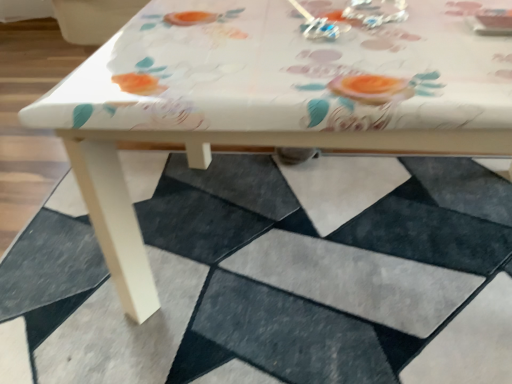
Question: Could you tell me if metallic silver earrings at upper center is facing white matte rug at lower center?

Choices:
 (A) no
 (B) yes

Answer: (A)

Question: From the image's perspective, is metallic silver earrings at upper center located beneath white matte rug at lower center?

Choices:
 (A) no
 (B) yes

Answer: (A)

Question: Is metallic silver earrings at upper center not close to white matte rug at lower center?

Choices:
 (A) yes
 (B) no

Answer: (B)

Question: Is metallic silver earrings at upper center outside of white matte rug at lower center?

Choices:
 (A) no
 (B) yes

Answer: (B)

Question: From a real-world perspective, does metallic silver earrings at upper center sit lower than white matte rug at lower center?

Choices:
 (A) yes
 (B) no

Answer: (B)

Question: Is metallic silver earrings at upper center surrounding white matte rug at lower center?

Choices:
 (A) no
 (B) yes

Answer: (A)

Question: Does white matte rug at lower center have a lesser width compared to metallic silver earrings at upper center?

Choices:
 (A) yes
 (B) no

Answer: (B)

Question: Considering the relative sizes of white matte rug at lower center and metallic silver earrings at upper center in the image provided, is white matte rug at lower center taller than metallic silver earrings at upper center?

Choices:
 (A) yes
 (B) no

Answer: (A)

Question: Are white matte rug at lower center and metallic silver earrings at upper center far apart?

Choices:
 (A) yes
 (B) no

Answer: (B)

Question: Is white matte rug at lower center to the right of metallic silver earrings at upper center from the viewer's perspective?

Choices:
 (A) no
 (B) yes

Answer: (A)

Question: Could you tell me if white matte rug at lower center is facing metallic silver earrings at upper center?

Choices:
 (A) no
 (B) yes

Answer: (A)

Question: Are white matte rug at lower center and metallic silver earrings at upper center making contact?

Choices:
 (A) yes
 (B) no

Answer: (B)

Question: In the image, is metallic silver earrings at upper center on the left side or the right side of white matte rug at lower center?

Choices:
 (A) left
 (B) right

Answer: (B)